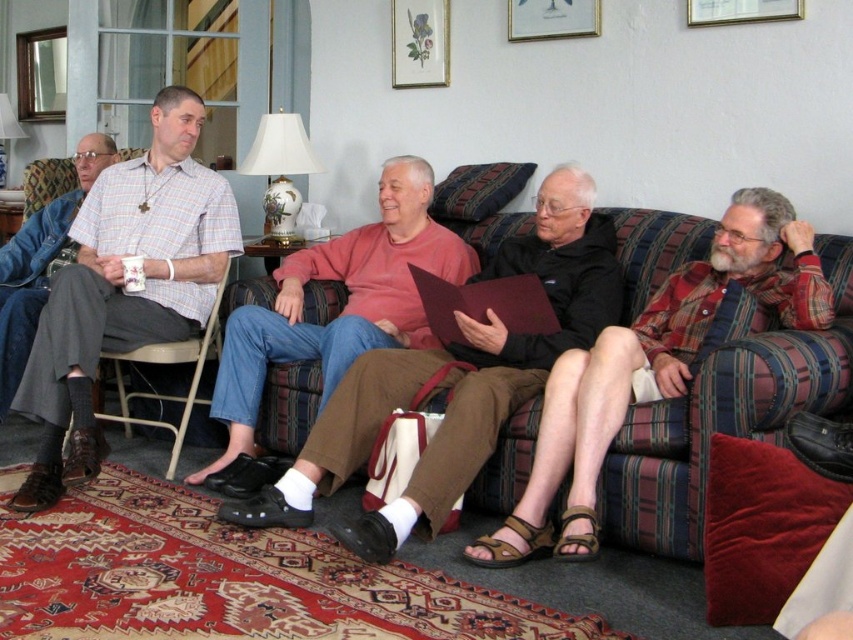
You are a delivery person who needs to place a 2.5 meter long package between the plaid flannel shirt at right and the matte glass picture frame at upper center. Can you fit the package between them?

The distance between the plaid flannel shirt at right and the matte glass picture frame at upper center is 1.90 meters. Since the package is 2.5 meters long, it cannot fit between them as the space is shorter than the package.

You are arranging a photo shoot in this living room and need to place a new lamp between the plaid flannel shirt at right and the matte glass picture frame at upper center. Based on their current positions, which object should the lamp be closer to?

The plaid flannel shirt at right is positioned on the right side of the matte glass picture frame at upper center. Therefore, the lamp should be placed closer to the plaid flannel shirt at right since it is located to the right of the matte glass picture frame at upper center.